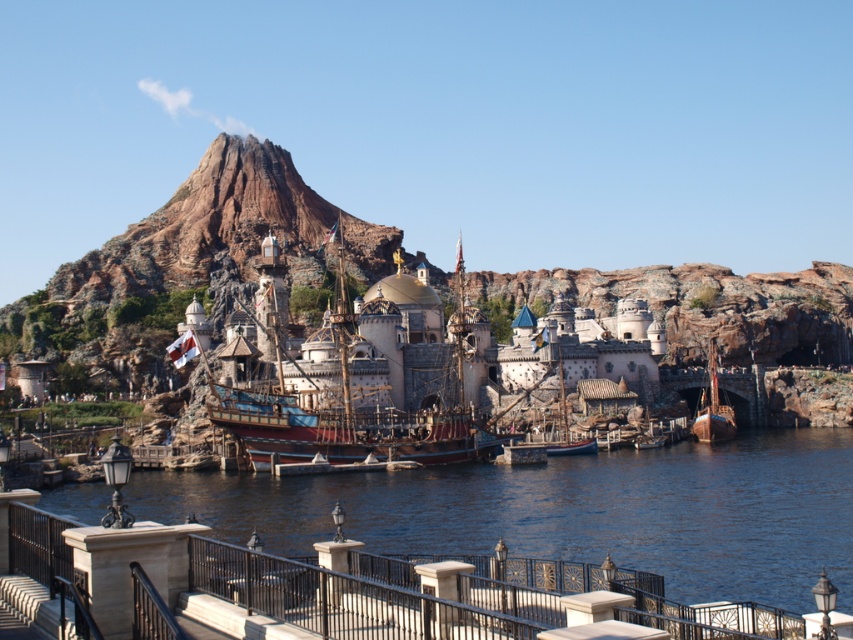
Based on the photo, is wooden sailboat at center in front of wooden ship at lower right?

Yes, it is in front of wooden ship at lower right.

Is wooden sailboat at center wider than wooden ship at lower right?

Correct, the width of wooden sailboat at center exceeds that of wooden ship at lower right.

Locate an element on the screen. This screenshot has width=853, height=640. wooden sailboat at center is located at coordinates (550, 387).

This screenshot has width=853, height=640. What do you see at coordinates (383, 385) in the screenshot?
I see `wooden ship at center` at bounding box center [383, 385].

Is point (416, 394) less distant than point (712, 364)?

Yes, it is in front of point (712, 364).

Find the location of a particular element. The width and height of the screenshot is (853, 640). wooden ship at center is located at coordinates (383, 385).

Find the location of `wooden ship at center`. wooden ship at center is located at coordinates (383, 385).

Is point (471, 448) positioned in front of point (593, 371)?

Yes, it is in front of point (593, 371).

Does wooden ship at center have a greater width compared to wooden sailboat at center?

Yes.

Which is behind, point (354, 372) or point (566, 337)?

Point (566, 337)

The width and height of the screenshot is (853, 640). I want to click on wooden ship at center, so click(x=383, y=385).